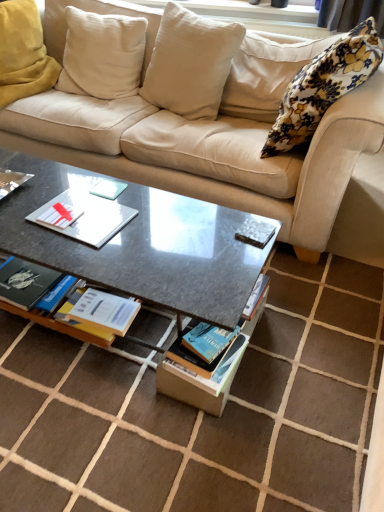
Question: From the image's perspective, is blue matte book at center, placed as the 2th magazine when sorted from top to bottom, above or below soft white cushion at upper left, the first pillow when ordered from left to right?

Choices:
 (A) above
 (B) below

Answer: (B)

Question: Considering their positions, is blue matte book at center, placed as the 2th magazine when sorted from top to bottom, located in front of or behind soft white cushion at upper left, the first pillow when ordered from left to right?

Choices:
 (A) front
 (B) behind

Answer: (A)

Question: Estimate the real-world distances between objects in this image. Which object is farther from the soft white cushion at upper left, which is counted as the fourth pillow, starting from the right?

Choices:
 (A) white cotton pillow at upper center, which is the 2th pillow from right to left
 (B) metallic silver book at left, which is the 2th book in bottom-to-top order
 (C) white matte paper at center
 (D) blue matte book at center, which is the 1th magazine from bottom to top
 (E) beige fabric couch at upper center

Answer: (D)

Question: Which object is the farthest from the metallic silver book at left, which is the 2th book in bottom-to-top order?

Choices:
 (A) granite gray coffee table at center
 (B) soft white cushion at upper left, the first pillow when ordered from left to right
 (C) white matte paper at center
 (D) metallic silver magazine at center, the 1th magazine viewed from the top
 (E) beige fabric couch at upper center

Answer: (B)